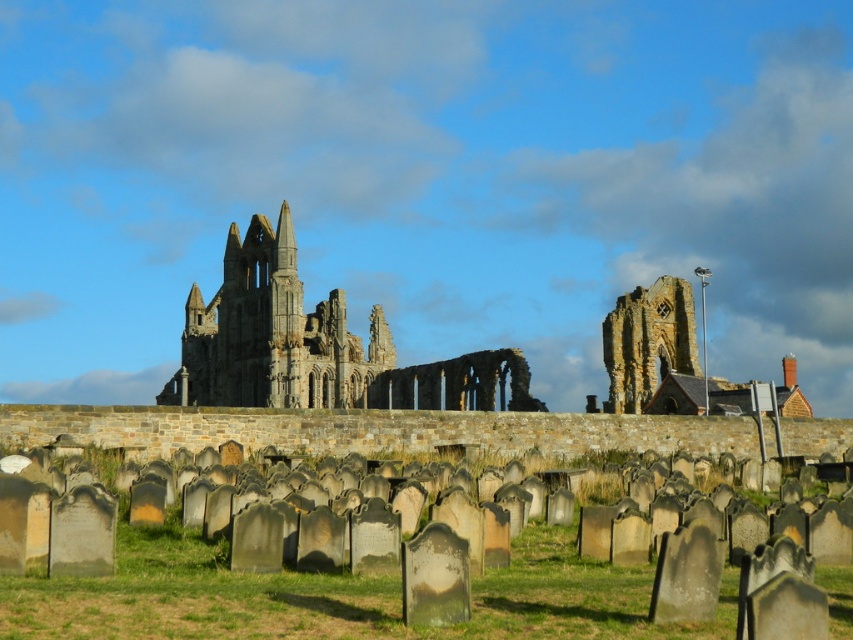
Is point (404, 369) positioned before point (635, 385)?

No, (404, 369) is further to viewer.

Who is shorter, stone gothic ruins at center or stone archway at center?

stone archway at center is shorter.

What do you see at coordinates (316, 346) in the screenshot? The height and width of the screenshot is (640, 853). I see `stone gothic ruins at center` at bounding box center [316, 346].

Identify the location of stone gothic ruins at center. Image resolution: width=853 pixels, height=640 pixels. (316, 346).

Which is more to the right, green grass at lower center or stone archway at center?

stone archway at center

Can you confirm if green grass at lower center is shorter than stone archway at center?

Yes, green grass at lower center is shorter than stone archway at center.

Identify the location of green grass at lower center. (335, 596).

Find the location of a particular element. green grass at lower center is located at coordinates (335, 596).

Is green grass at lower center further to the viewer compared to stone gothic ruins at center?

No, green grass at lower center is in front of stone gothic ruins at center.

Does point (293, 627) lie in front of point (381, 374)?

Yes, it is.

Describe the element at coordinates (335, 596) in the screenshot. I see `green grass at lower center` at that location.

This screenshot has width=853, height=640. Identify the location of green grass at lower center. (335, 596).